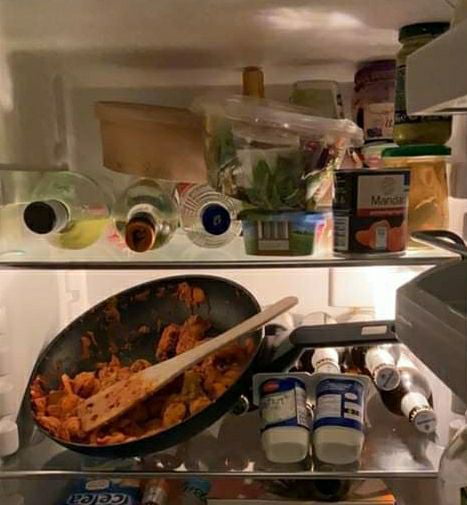
Where is `glass bottles`? This screenshot has width=467, height=505. glass bottles is located at coordinates (64, 196), (145, 202), (207, 192).